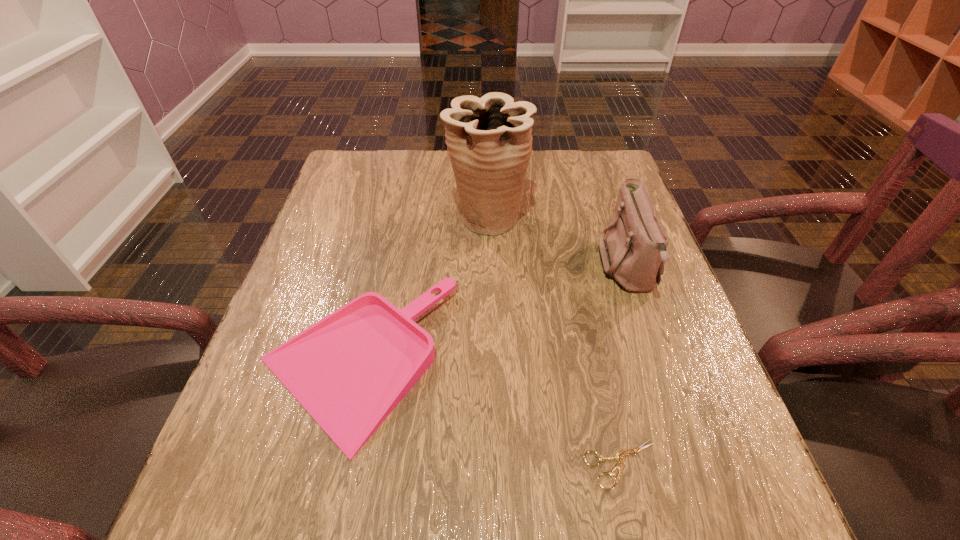
I want to click on the second closest object relative to the dustpan, so click(x=620, y=456).

Identify the location of object that is the second nearest to the third shortest object. This screenshot has height=540, width=960. (620, 456).

Where is `vacant space that satisfies the following two spatial constraints: 1. on the handle side of the third tallest object; 2. on the right side of the shortest object`? vacant space that satisfies the following two spatial constraints: 1. on the handle side of the third tallest object; 2. on the right side of the shortest object is located at coordinates (332, 464).

Image resolution: width=960 pixels, height=540 pixels. In order to click on vacant area that satisfies the following two spatial constraints: 1. on the handle side of the shortest object; 2. on the right side of the dustpan in this screenshot , I will do (332, 464).

At what (x,y) coordinates should I click in order to perform the action: click on vacant region that satisfies the following two spatial constraints: 1. on the front pocket of the shoulder bag; 2. on the front side of the shears. Please return your answer as a coordinate pair (x, y). The width and height of the screenshot is (960, 540). Looking at the image, I should click on (696, 464).

This screenshot has height=540, width=960. I want to click on blank space that satisfies the following two spatial constraints: 1. on the front side of the tallest object; 2. on the handle side of the dustpan, so click(x=490, y=361).

In order to click on vacant point that satisfies the following two spatial constraints: 1. on the handle side of the dustpan; 2. on the left side of the shortest object in this screenshot , I will do `click(332, 464)`.